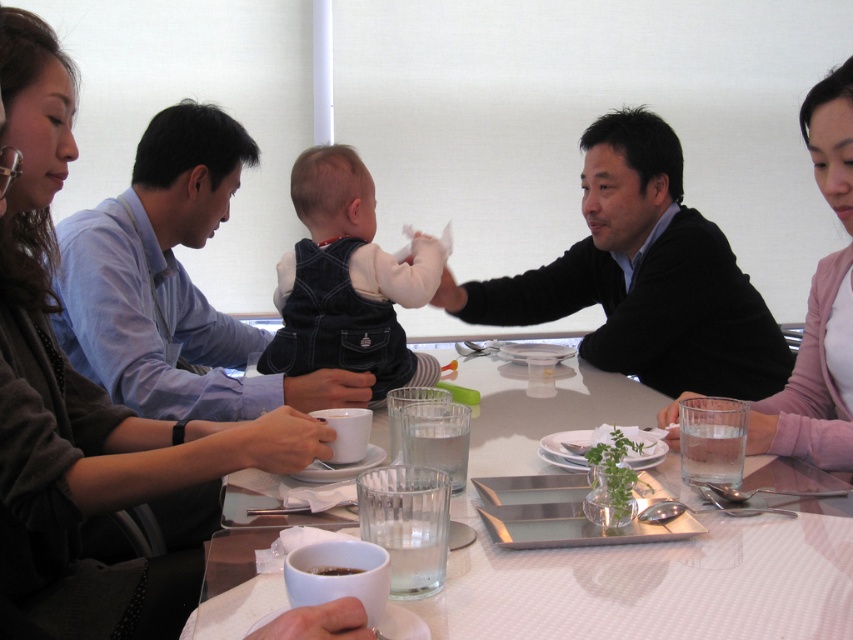
You are at the rectangular table in the dining scene. Where is the denim overalls at center located relative to the table?

The denim overalls at center is located at point (347,282) relative to the table.

You are a server who needs to place a new dish on the table. The dish requires a space wider than the dark brown glossy coffee cup at lower center. Is there enough space next to the denim overalls at center?

The denim overalls at center has a larger width than the dark brown glossy coffee cup at lower center, so there is enough space next to the denim overalls at center for the dish.

You are a server in a restaurant. You need to place a new order of a large salad plate that is 30 cm in diameter onto the table. The table has limited space between the denim overalls at center and the dark brown glossy coffee cup at lower center. Can you fit the salad plate there?

The denim overalls at center is larger in size compared to the dark brown glossy coffee cup at lower center. Since the salad plate is 30 cm in diameter, it may not fit between them if the space between the two objects is smaller than 30 cm. However, the exact distance isn not provided, so it depends on the available space between them.